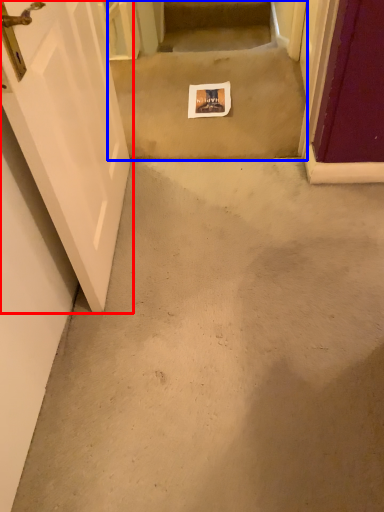
Question: Which object appears closest to the camera in this image, door (highlighted by a red box) or stairwell (highlighted by a blue box)?

Choices:
 (A) door
 (B) stairwell

Answer: (A)